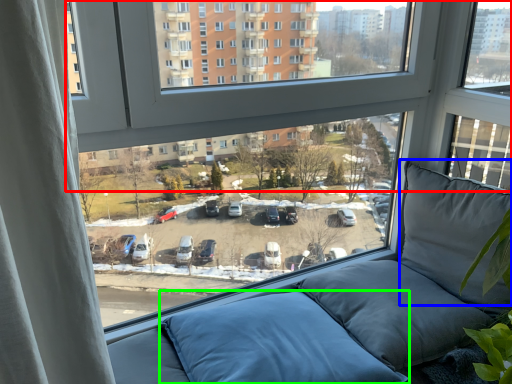
Question: Which object is the farthest from window (highlighted by a red box)? Choose among these: pillow (highlighted by a blue box) or pillow (highlighted by a green box).

Choices:
 (A) pillow
 (B) pillow

Answer: (B)